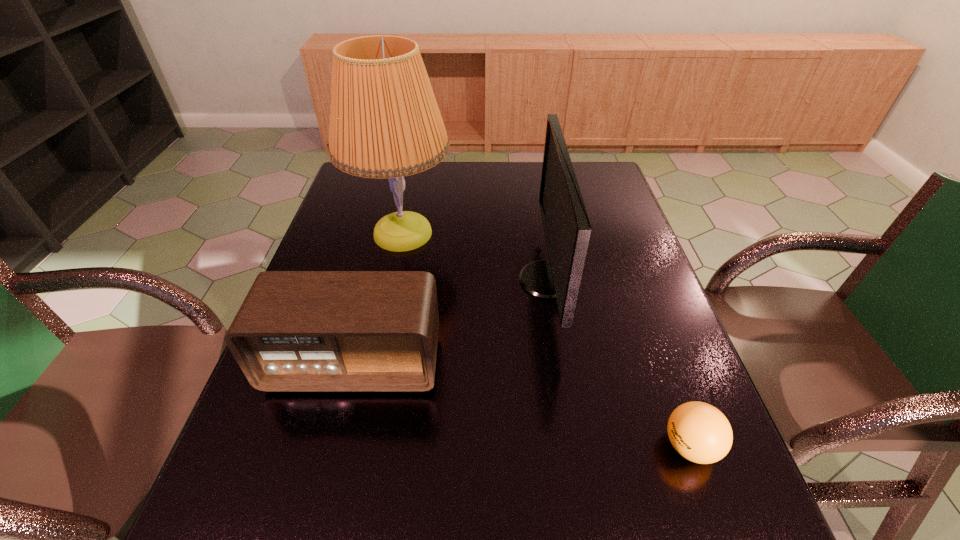
The image size is (960, 540). I want to click on free space located 0.110m on the front-facing side of the second shortest object, so click(333, 448).

Locate an element on the screen. free space located 0.130m on the side with brand of the rightmost object is located at coordinates point(592,446).

I want to click on vacant space situated 0.230m on the side with brand of the rightmost object, so click(x=539, y=446).

Locate an element on the screen. This screenshot has width=960, height=540. vacant area located 0.290m on the side with brand of the rightmost object is located at coordinates (506, 446).

At what (x,y) coordinates should I click in order to perform the action: click on lamp present at the left edge. Please return your answer as a coordinate pair (x, y). This screenshot has width=960, height=540. Looking at the image, I should click on (385, 122).

I want to click on radio receiver positioned at the left edge, so click(x=296, y=330).

The image size is (960, 540). Find the location of `object located in the right edge section of the desktop`. object located in the right edge section of the desktop is located at coordinates (698, 431).

Locate an element on the screen. Image resolution: width=960 pixels, height=540 pixels. vacant position at the far edge of the desktop is located at coordinates point(489,180).

Image resolution: width=960 pixels, height=540 pixels. In order to click on blank space at the near edge of the desktop in this screenshot , I will do pyautogui.click(x=375, y=529).

Locate an element on the screen. The width and height of the screenshot is (960, 540). vacant space at the left edge of the desktop is located at coordinates (375, 205).